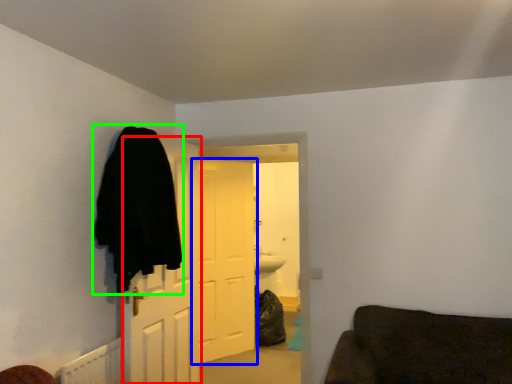
Question: Considering the real-world distances, which object is farthest from door (highlighted by a red box)? door (highlighted by a blue box) or cloak (highlighted by a green box)?

Choices:
 (A) door
 (B) cloak

Answer: (A)